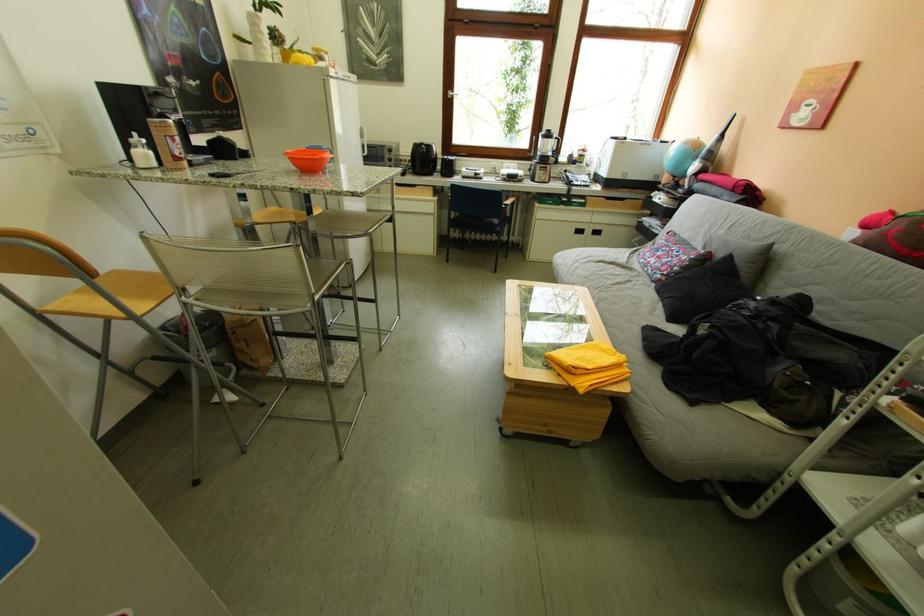
Where is `window handle`? window handle is located at coordinates (453, 95).